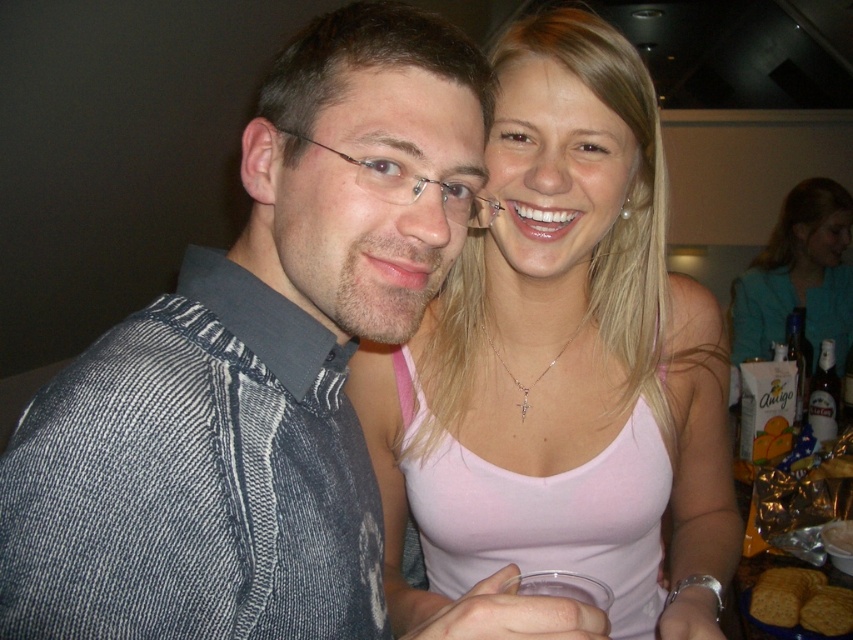
You are a photographer trying to focus on the pink fabric tank top at upper center. Based on its coordinates, where should you aim your camera lens?

The pink fabric tank top at upper center is located at coordinates point [564,362], so aim your camera lens there to focus on it.

You are a photographer at a party and need to adjust the camera focus between the two pink fabric tank top at upper center and pink fabric tank top at upper right. Given that the camera can only focus on objects within 1.5 meters of each other, will you need to adjust the focus for both?

The pink fabric tank top at upper center is 1.81 meters away from the pink fabric tank top at upper right, which exceeds the camera focus range of 1.5 meters. Therefore, you will need to adjust the focus for both separately.